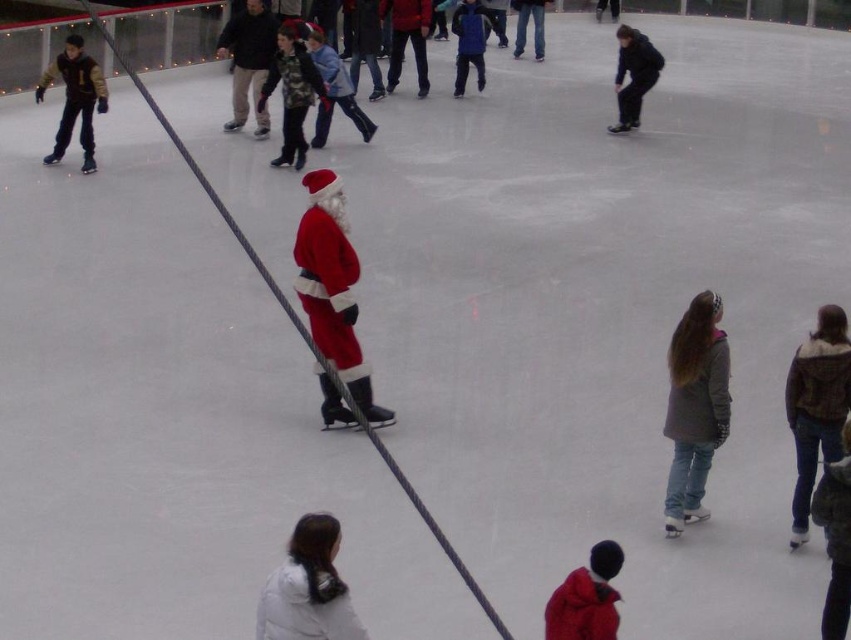
Does white matte jacket at lower center have a lesser height compared to matte black jacket at left?

Indeed, white matte jacket at lower center has a lesser height compared to matte black jacket at left.

Is point (343, 592) positioned behind point (101, 106)?

No.

Which is in front, point (337, 634) or point (100, 80)?

Point (337, 634) is in front.

The image size is (851, 640). What are the coordinates of `white matte jacket at lower center` in the screenshot? It's located at (307, 588).

Between red woolen coat at lower center and matte black jacket at left, which one appears on the right side from the viewer's perspective?

red woolen coat at lower center is more to the right.

Does red woolen coat at lower center appear under matte black jacket at left?

Yes, red woolen coat at lower center is below matte black jacket at left.

Is point (614, 560) positioned after point (50, 67)?

No, it is not.

This screenshot has height=640, width=851. Identify the location of red woolen coat at lower center. (586, 596).

Does red woolen coat at lower center have a greater height compared to dark blue jacket at upper right?

A: No, red woolen coat at lower center is not taller than dark blue jacket at upper right.

Which is more to the left, red woolen coat at lower center or dark blue jacket at upper right?

From the viewer's perspective, red woolen coat at lower center appears more on the left side.

Which is in front, point (592, 548) or point (621, 116)?

Point (592, 548) is more forward.

At what (x,y) coordinates should I click in order to perform the action: click on red woolen coat at lower center. Please return your answer as a coordinate pair (x, y). This screenshot has height=640, width=851. Looking at the image, I should click on (586, 596).